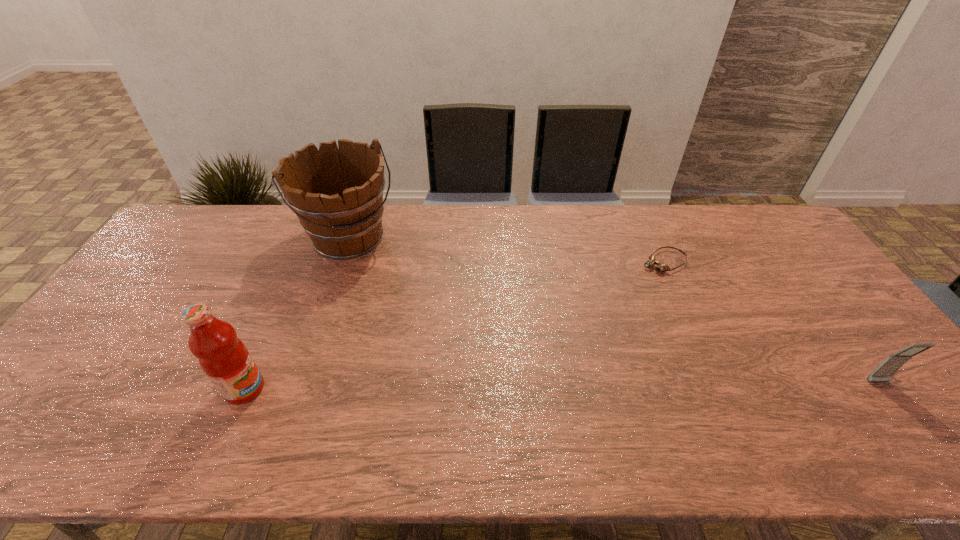
The height and width of the screenshot is (540, 960). I want to click on free space on the desktop that is between the fruit juice and the third tallest object and is positioned on the front lenses and sides of the goggles, so click(x=469, y=387).

Locate an element on the screen. free space on the desktop that is between the fruit juice and the cellular telephone and is positioned with the handle on the wine bucket is located at coordinates (468, 387).